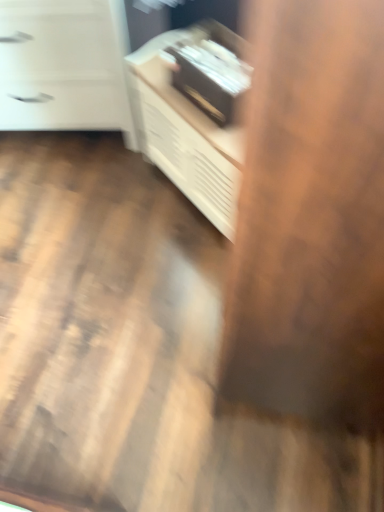
Question: From the image's perspective, is white wood cabinet at upper center located above or below white matte chest of drawers at upper left?

Choices:
 (A) above
 (B) below

Answer: (B)

Question: Is white wood cabinet at upper center bigger or smaller than white matte chest of drawers at upper left?

Choices:
 (A) big
 (B) small

Answer: (B)

Question: Does point (230, 228) appear closer or farther from the camera than point (130, 129)?

Choices:
 (A) farther
 (B) closer

Answer: (B)

Question: Considering the positions of white matte chest of drawers at upper left and white wood cabinet at upper center in the image, is white matte chest of drawers at upper left bigger or smaller than white wood cabinet at upper center?

Choices:
 (A) big
 (B) small

Answer: (A)

Question: Relative to white wood cabinet at upper center, is white matte chest of drawers at upper left in front or behind?

Choices:
 (A) behind
 (B) front

Answer: (A)

Question: From the image's perspective, relative to white wood cabinet at upper center, is white matte chest of drawers at upper left above or below?

Choices:
 (A) above
 (B) below

Answer: (A)

Question: Would you say white matte chest of drawers at upper left is inside or outside white wood cabinet at upper center?

Choices:
 (A) outside
 (B) inside

Answer: (A)